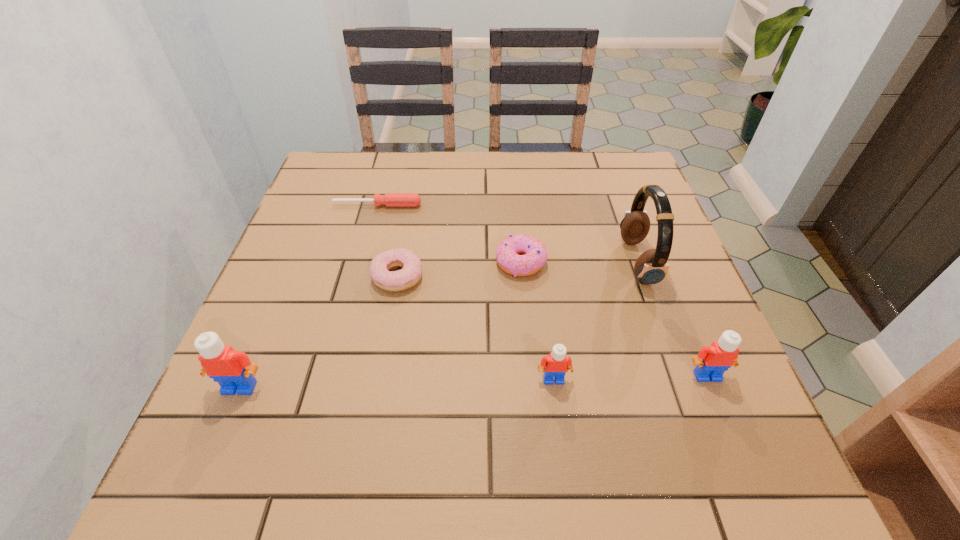
Locate an element on the screen. Image resolution: width=960 pixels, height=540 pixels. free space between the farthest object and the second shortest object is located at coordinates (388, 240).

The image size is (960, 540). In order to click on free space between the tallest object and the third shortest object in this screenshot , I will do `click(579, 262)`.

Choose which object is the third nearest neighbor to the taller doughnut. Please provide its 2D coordinates. Your answer should be formatted as a tuple, i.e. [(x, y)], where the tuple contains the x and y coordinates of a point satisfying the conditions above.

[(389, 199)]

The image size is (960, 540). What are the coordinates of `object that is the closest to the shorter doughnut` in the screenshot? It's located at (535, 254).

You are a GUI agent. You are given a task and a screenshot of the screen. Output one action in this format:
    pyautogui.click(x=<x>, y=<y>)
    Task: Click on the closest Lego to the right doughnut
    
    Given the screenshot: What is the action you would take?
    pyautogui.click(x=555, y=365)

Locate an element on the screen. The image size is (960, 540). Lego that is the closest one to the headset is located at coordinates (712, 361).